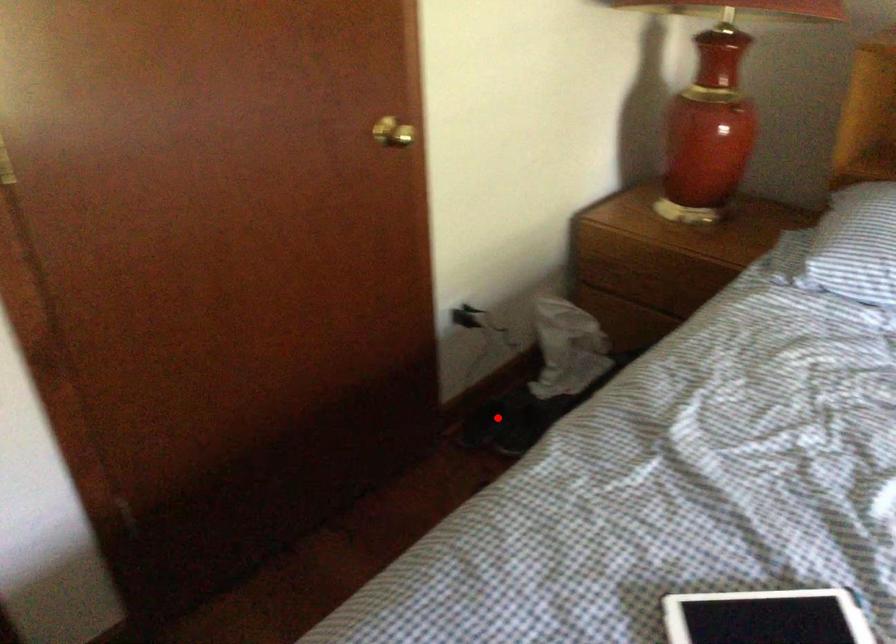
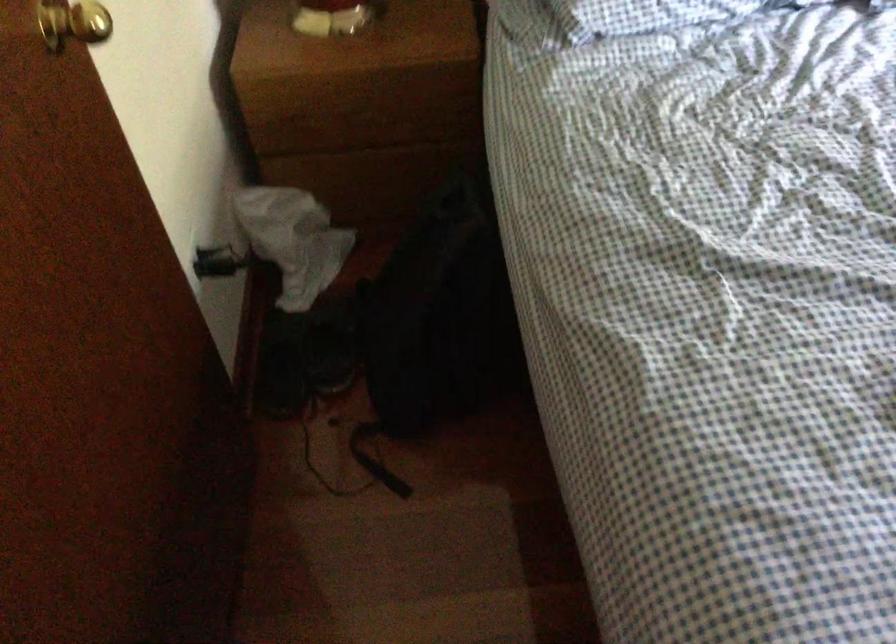
Question: I am providing you with two images of the same scene from different viewpoints. In image1, a red point is highlighted. Considering the same 3D point in image2, which of the following is correct?

Choices:
 (A) It is closer
 (B) It is farther

Answer: (A)